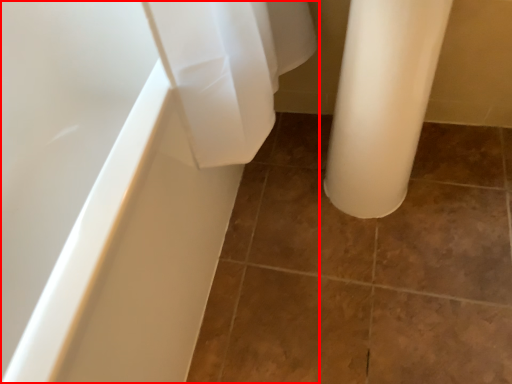
Question: From the image's perspective, where is bathtub (annotated by the red box) located in relation to ceramic tile in the image?

Choices:
 (A) below
 (B) above

Answer: (B)